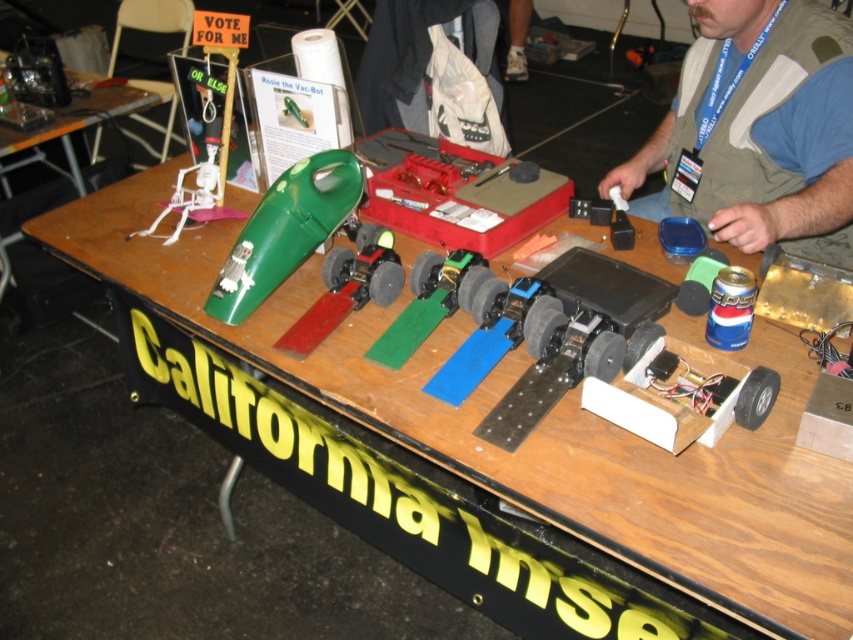
Measure the distance from brown fabric vest at upper right to white plastic skeleton at upper left.

brown fabric vest at upper right is 3.36 feet away from white plastic skeleton at upper left.

Between brown fabric vest at upper right and white plastic skeleton at upper left, which one appears on the left side from the viewer's perspective?

From the viewer's perspective, white plastic skeleton at upper left appears more on the left side.

Does point (846, 40) come in front of point (190, 195)?

Yes, it is.

Where is `brown fabric vest at upper right`? This screenshot has height=640, width=853. brown fabric vest at upper right is located at coordinates (759, 131).

Does green matte vacuum cleaner at center appear on the right side of white plastic skeleton at upper left?

Indeed, green matte vacuum cleaner at center is positioned on the right side of white plastic skeleton at upper left.

Is the position of green matte vacuum cleaner at center more distant than that of white plastic skeleton at upper left?

No, green matte vacuum cleaner at center is closer to the viewer.

This screenshot has height=640, width=853. Describe the element at coordinates (286, 230) in the screenshot. I see `green matte vacuum cleaner at center` at that location.

You are a GUI agent. You are given a task and a screenshot of the screen. Output one action in this format:
    pyautogui.click(x=<x>, y=<y>)
    Task: Click on the green matte vacuum cleaner at center
    The image size is (853, 640).
    Given the screenshot: What is the action you would take?
    pyautogui.click(x=286, y=230)

Can you confirm if brown fabric vest at upper right is positioned below green matte vacuum cleaner at center?

Incorrect, brown fabric vest at upper right is not positioned below green matte vacuum cleaner at center.

Who is more distant from viewer, (833,209) or (320,186)?

Point (320,186)

Where is `brown fabric vest at upper right`? Image resolution: width=853 pixels, height=640 pixels. brown fabric vest at upper right is located at coordinates (759, 131).